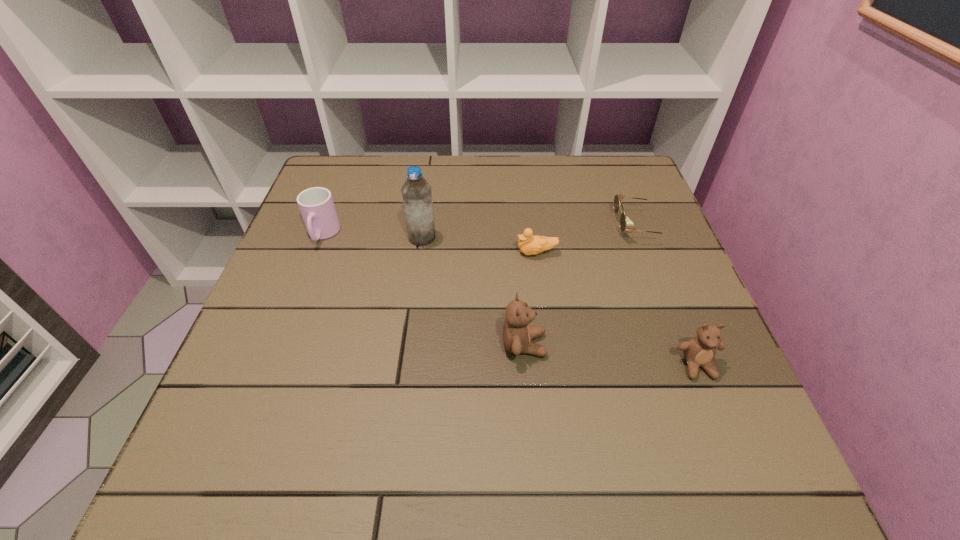
At what (x,y) coordinates should I click in order to perform the action: click on teddy bear at the right edge. Please return your answer as a coordinate pair (x, y). Looking at the image, I should click on (699, 351).

Locate an element on the screen. The height and width of the screenshot is (540, 960). sunglasses that is at the right edge is located at coordinates coord(618,198).

This screenshot has height=540, width=960. In order to click on object present at the near right corner in this screenshot , I will do `click(699, 351)`.

What are the coordinates of `free space at the far edge of the desktop` in the screenshot? It's located at (539, 167).

Find the location of `vacant area at the near edge`. vacant area at the near edge is located at coordinates (464, 394).

Where is `free space at the right edge of the desktop`? The height and width of the screenshot is (540, 960). free space at the right edge of the desktop is located at coordinates (667, 264).

The image size is (960, 540). In order to click on vacant region at the far left corner of the desktop in this screenshot , I will do `click(361, 164)`.

Image resolution: width=960 pixels, height=540 pixels. In the image, there is a desktop. What are the coordinates of `vacant space at the near left corner` in the screenshot? It's located at (306, 392).

Find the location of a particular element. vacant space at the far right corner is located at coordinates (606, 189).

You are a GUI agent. You are given a task and a screenshot of the screen. Output one action in this format:
    pyautogui.click(x=<x>, y=<y>)
    Task: Click on the free space at the near right corner
    Image resolution: width=960 pixels, height=540 pixels.
    Given the screenshot: What is the action you would take?
    pyautogui.click(x=676, y=382)